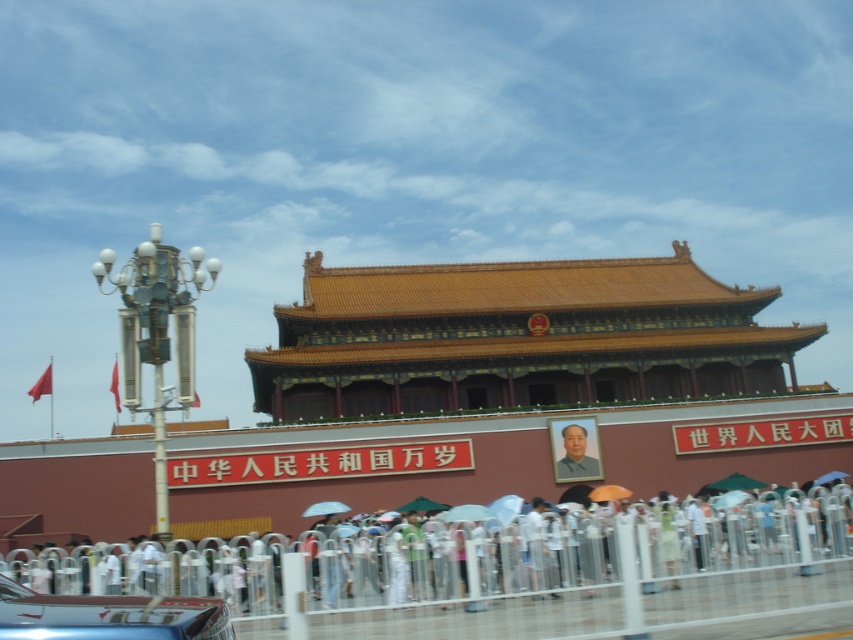
Between point (343, 310) and point (160, 636), which one is positioned behind?

The point (343, 310) is more distant.

Does brown/golden/stone palace at center appear on the left side of metallic blue car at lower left?

Incorrect, brown/golden/stone palace at center is not on the left side of metallic blue car at lower left.

Does point (686, 390) come behind point (100, 628)?

Yes, point (686, 390) is farther from viewer.

Find the location of a particular element. The height and width of the screenshot is (640, 853). brown/golden/stone palace at center is located at coordinates (506, 390).

Does golden glazed tile roof at center have a greater width compared to metallic blue car at lower left?

Indeed, golden glazed tile roof at center has a greater width compared to metallic blue car at lower left.

Is golden glazed tile roof at center to the left of metallic blue car at lower left from the viewer's perspective?

In fact, golden glazed tile roof at center is to the right of metallic blue car at lower left.

Does point (393, 308) lie in front of point (128, 596)?

No, it is not.

Locate an element on the screen. The width and height of the screenshot is (853, 640). golden glazed tile roof at center is located at coordinates (517, 337).

Where is `metallic blue car at lower left`? metallic blue car at lower left is located at coordinates (108, 616).